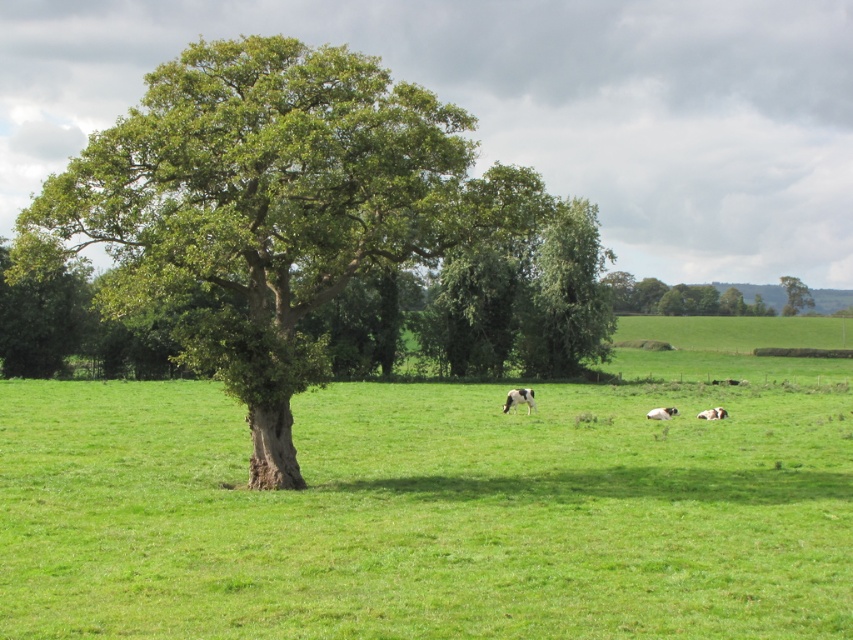
You are a farmer checking the pasture. The green grass pasture at center and the white speckled fur at lower right are both visible. Which one covers more area in the image?

The green grass pasture at center covers more area than the white speckled fur at lower right because its width is larger.

You are standing at the point marked by the coordinates point (444, 502) in the image. What is the name of the object you are currently standing on?

The point (444, 502) marks the green grass pasture at center, so you are standing on the green grass pasture at center.